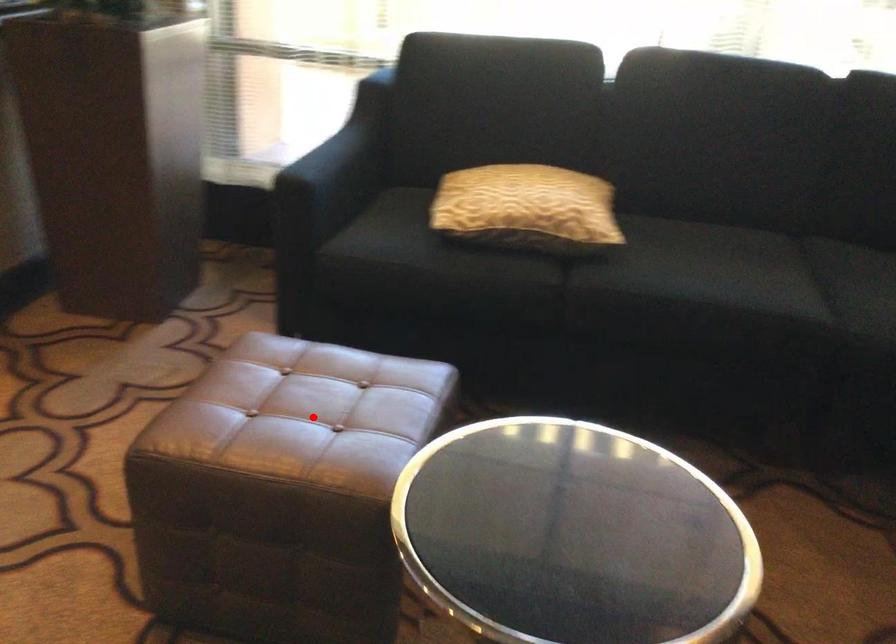
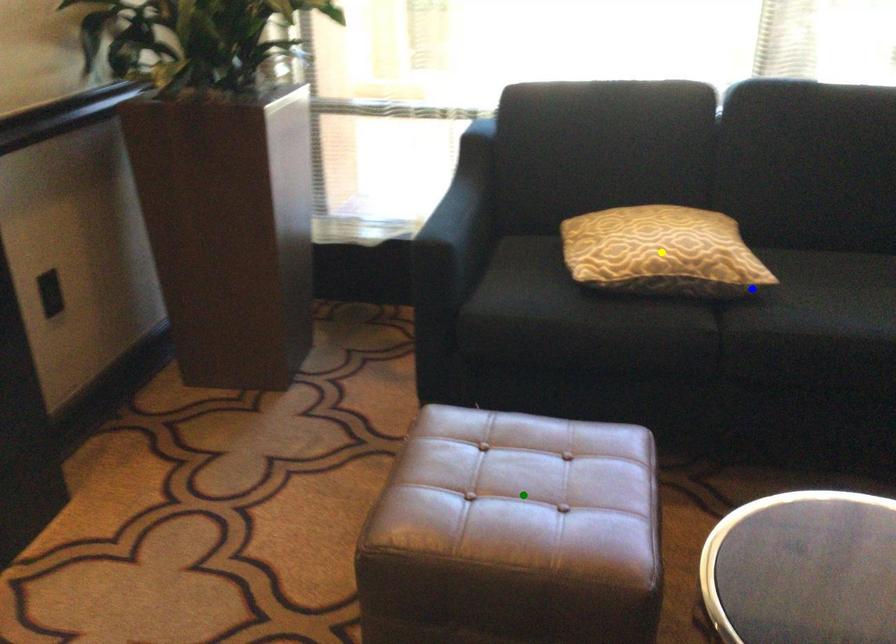
Question: I am providing you with two images of the same scene from different viewpoints. A red point is marked on the first image. You are given multiple points on the second image. Which point in image 2 is actually the same real-world point as the red point in image 1?

Choices:
 (A) blue point
 (B) green point
 (C) yellow point

Answer: (B)